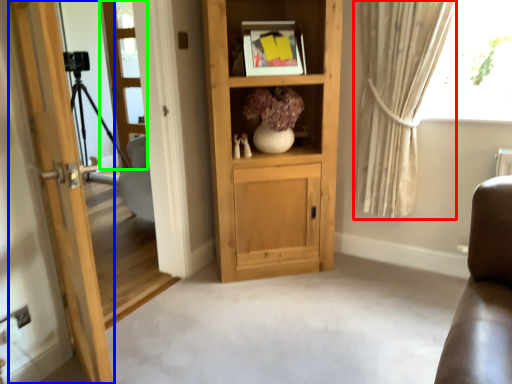
Question: Which is farther away from curtain (highlighted by a red box)? door (highlighted by a blue box) or screen door (highlighted by a green box)?

Choices:
 (A) door
 (B) screen door

Answer: (B)